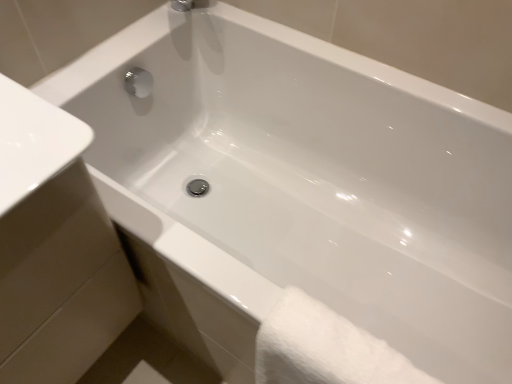
Question: Do you think white glossy sink at lower left is within white fluffy towel at lower right, or outside of it?

Choices:
 (A) inside
 (B) outside

Answer: (B)

Question: Would you say white glossy sink at lower left is to the left or to the right of white fluffy towel at lower right in the picture?

Choices:
 (A) right
 (B) left

Answer: (B)

Question: From the image's perspective, relative to white fluffy towel at lower right, is white glossy sink at lower left above or below?

Choices:
 (A) above
 (B) below

Answer: (A)

Question: From a real-world perspective, is white fluffy towel at lower right above or below white glossy sink at lower left?

Choices:
 (A) below
 (B) above

Answer: (A)

Question: Considering the positions of point (295, 350) and point (25, 261), is point (295, 350) closer or farther from the camera than point (25, 261)?

Choices:
 (A) closer
 (B) farther

Answer: (B)

Question: From the image's perspective, is white fluffy towel at lower right positioned above or below white glossy sink at lower left?

Choices:
 (A) below
 (B) above

Answer: (A)

Question: In the image, is white fluffy towel at lower right positioned in front of or behind white glossy sink at lower left?

Choices:
 (A) behind
 (B) front

Answer: (A)